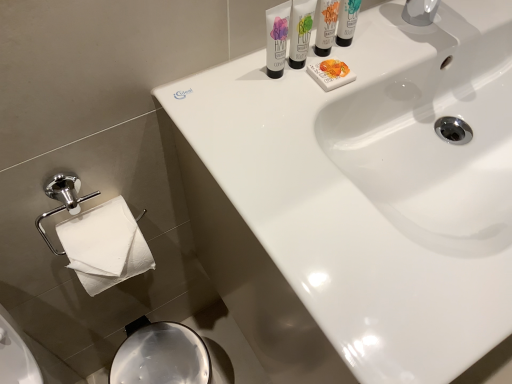
I want to click on empty space that is to the right of white glossy tube at upper center, arranged as the 1th shaving cream when viewed from the left, so (374, 57).